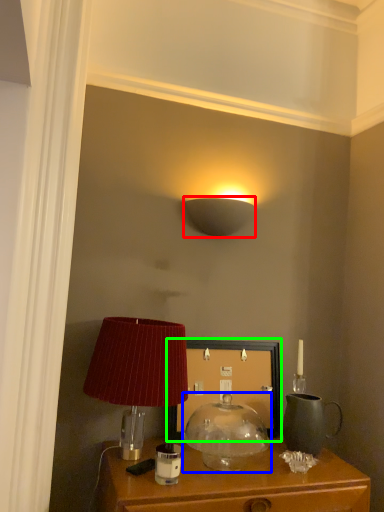
Question: Which object is the closest to the lamp (highlighted by a red box)? Choose among these: lamp (highlighted by a blue box) or picture frame (highlighted by a green box).

Choices:
 (A) lamp
 (B) picture frame

Answer: (B)